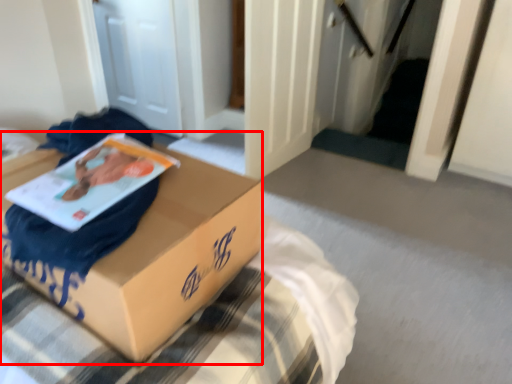
Question: Considering the relative positions of box (annotated by the red box) and paperback book in the image provided, where is box (annotated by the red box) located with respect to the staircase?

Choices:
 (A) left
 (B) right

Answer: (B)